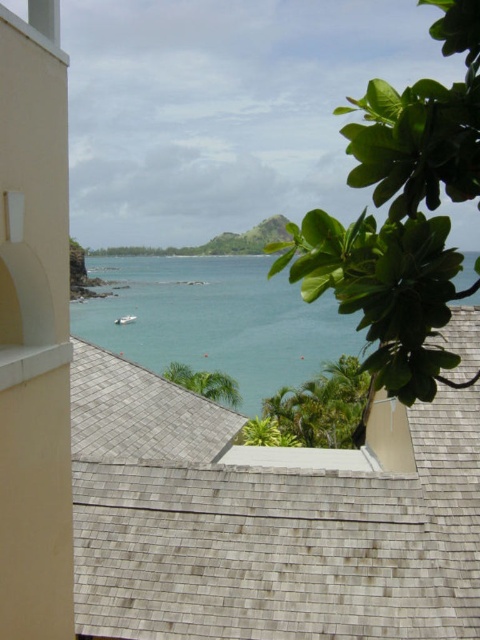
You are standing on a balcony overlooking the coast and notice the gray shingles at center and the clear blue water at center. Which of these two objects is located to the left of the other?

The gray shingles at center is positioned on the left side of clear blue water at center.

You are standing on a balcony overlooking the coast and see the gray shingles at center and the white matte boat at center. Which object appears larger in the scene?

The gray shingles at center appears larger than the white matte boat at center.